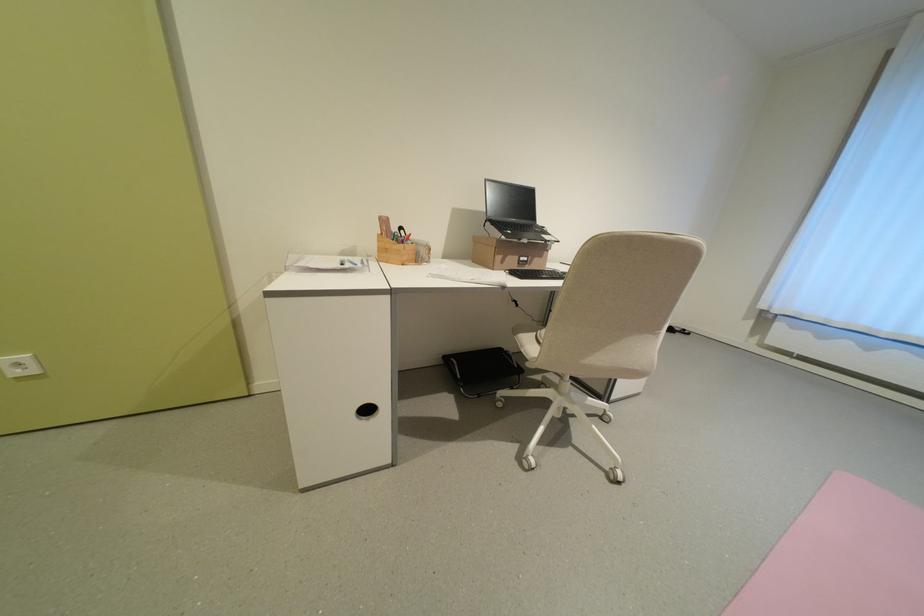
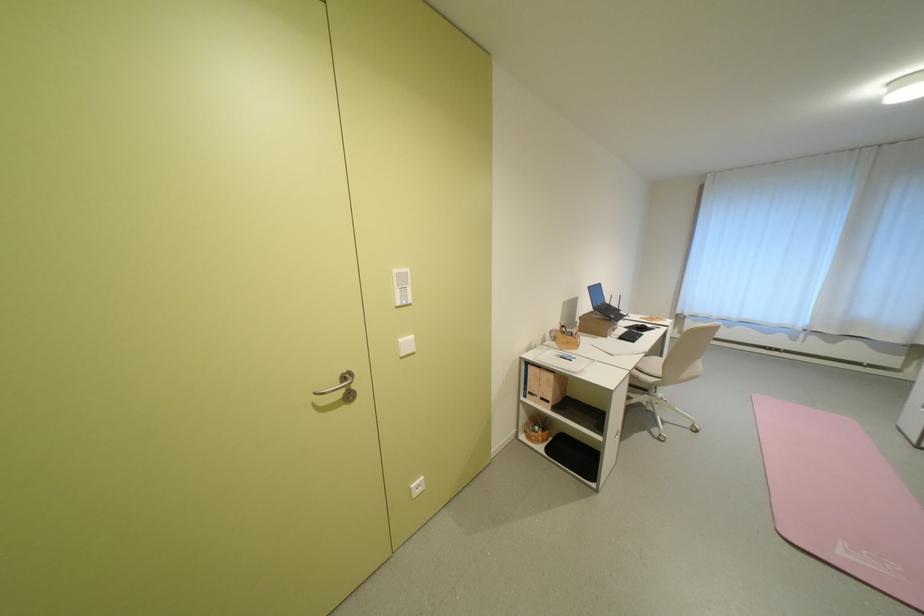
Question: What movement of the cameraman would produce the second image?

Choices:
 (A) Left
 (B) Right
 (C) Forward
 (D) Backward

Answer: (A)